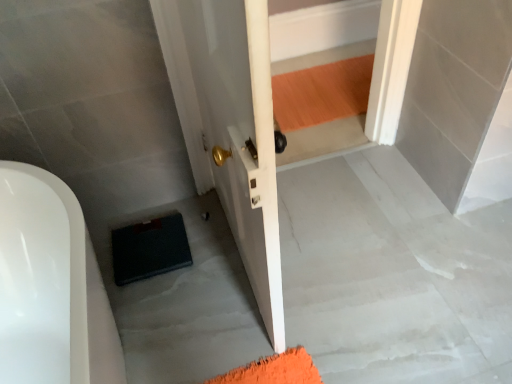
Where is `dark blue rubber mat at lower left`? dark blue rubber mat at lower left is located at coordinates (150, 248).

In order to face dark blue rubber mat at lower left, should I rotate leftwards or rightwards?

You should rotate left by 13.902 degrees.

The width and height of the screenshot is (512, 384). Describe the element at coordinates (150, 248) in the screenshot. I see `dark blue rubber mat at lower left` at that location.

What do you see at coordinates (393, 275) in the screenshot? The height and width of the screenshot is (384, 512). I see `black matte suitcase at lower left` at bounding box center [393, 275].

The image size is (512, 384). In order to click on black matte suitcase at lower left in this screenshot , I will do `click(393, 275)`.

Find the location of a particular element. The width and height of the screenshot is (512, 384). dark blue rubber mat at lower left is located at coordinates (150, 248).

Does black matte suitcase at lower left appear on the left side of dark blue rubber mat at lower left?

In fact, black matte suitcase at lower left is to the right of dark blue rubber mat at lower left.

Which object is further away from the camera taking this photo, black matte suitcase at lower left or dark blue rubber mat at lower left?

dark blue rubber mat at lower left.

Considering the points (448, 309) and (136, 265), which point is in front, point (448, 309) or point (136, 265)?

Positioned in front is point (448, 309).

From the image's perspective, is black matte suitcase at lower left on top of dark blue rubber mat at lower left?

No, from the image's perspective, black matte suitcase at lower left is not above dark blue rubber mat at lower left.

From a real-world perspective, who is located higher, black matte suitcase at lower left or dark blue rubber mat at lower left?

→ dark blue rubber mat at lower left, from a real-world perspective.

Considering the sizes of objects black matte suitcase at lower left and dark blue rubber mat at lower left in the image provided, who is wider, black matte suitcase at lower left or dark blue rubber mat at lower left?

With larger width is black matte suitcase at lower left.

From their relative heights in the image, would you say black matte suitcase at lower left is taller or shorter than dark blue rubber mat at lower left?

Considering their sizes, black matte suitcase at lower left has less height than dark blue rubber mat at lower left.

Based on their sizes in the image, would you say black matte suitcase at lower left is bigger or smaller than dark blue rubber mat at lower left?

Clearly, black matte suitcase at lower left is larger in size than dark blue rubber mat at lower left.

Is black matte suitcase at lower left not inside dark blue rubber mat at lower left?

Yes.

Is there a large distance between black matte suitcase at lower left and dark blue rubber mat at lower left?

black matte suitcase at lower left is near dark blue rubber mat at lower left, not far away.

Is black matte suitcase at lower left aimed at dark blue rubber mat at lower left?

No, black matte suitcase at lower left is not turned towards dark blue rubber mat at lower left.

How different are the orientations of black matte suitcase at lower left and dark blue rubber mat at lower left in degrees?

179 degrees.

The image size is (512, 384). What are the coordinates of `concrete below the dark blue rubber mat at lower left (from the image's perspective)` in the screenshot? It's located at (393, 275).

Which object is positioned more to the left, dark blue rubber mat at lower left or black matte suitcase at lower left?

From the viewer's perspective, dark blue rubber mat at lower left appears more on the left side.

From the picture: Is the depth of dark blue rubber mat at lower left less than that of black matte suitcase at lower left?

No, the depth of dark blue rubber mat at lower left is greater than that of black matte suitcase at lower left.

Is point (146, 223) closer to viewer compared to point (228, 238)?

No, (146, 223) is further to viewer.

From the image's perspective, who appears lower, dark blue rubber mat at lower left or black matte suitcase at lower left?

black matte suitcase at lower left.

From a real-world perspective, is dark blue rubber mat at lower left above or below black matte suitcase at lower left?

In terms of real-world spatial position, dark blue rubber mat at lower left is above black matte suitcase at lower left.

Looking at their sizes, would you say dark blue rubber mat at lower left is wider or thinner than black matte suitcase at lower left?

Clearly, dark blue rubber mat at lower left has less width compared to black matte suitcase at lower left.

From the picture: Considering the sizes of objects dark blue rubber mat at lower left and black matte suitcase at lower left in the image provided, who is taller, dark blue rubber mat at lower left or black matte suitcase at lower left?

dark blue rubber mat at lower left is taller.

In the scene shown: Between dark blue rubber mat at lower left and black matte suitcase at lower left, which one has smaller size?

dark blue rubber mat at lower left is smaller.

Is dark blue rubber mat at lower left not within black matte suitcase at lower left?

That's correct, dark blue rubber mat at lower left is outside of black matte suitcase at lower left.

Are dark blue rubber mat at lower left and black matte suitcase at lower left located far from each other?

dark blue rubber mat at lower left is actually quite close to black matte suitcase at lower left.

Is dark blue rubber mat at lower left turned away from black matte suitcase at lower left?

No, dark blue rubber mat at lower left's orientation is not away from black matte suitcase at lower left.

Find the location of a particular element. This screenshot has width=512, height=384. doormat positioned vertically above the black matte suitcase at lower left (from a real-world perspective) is located at coordinates (150, 248).

Locate an element on the screen. This screenshot has width=512, height=384. concrete that is on the right side of dark blue rubber mat at lower left is located at coordinates (393, 275).

Locate an element on the screen. This screenshot has height=384, width=512. doormat behind the black matte suitcase at lower left is located at coordinates (150, 248).